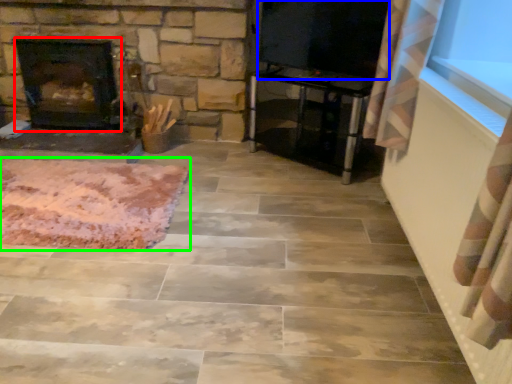
Question: Estimate the real-world distances between objects in this image. Which object is closer to fireplace (highlighted by a red box), window screen (highlighted by a blue box) or mat (highlighted by a green box)?

Choices:
 (A) window screen
 (B) mat

Answer: (B)